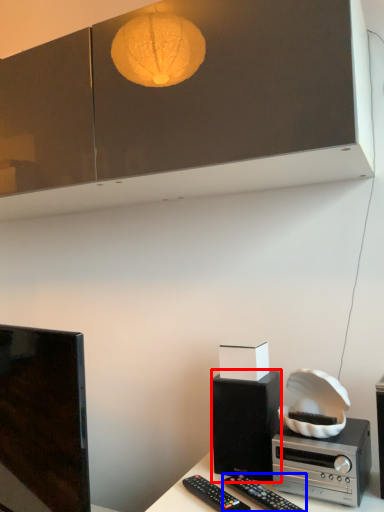
Question: Which object appears closest to the camera in this image, loudspeaker (highlighted by a red box) or remote control (highlighted by a blue box)?

Choices:
 (A) loudspeaker
 (B) remote control

Answer: (B)